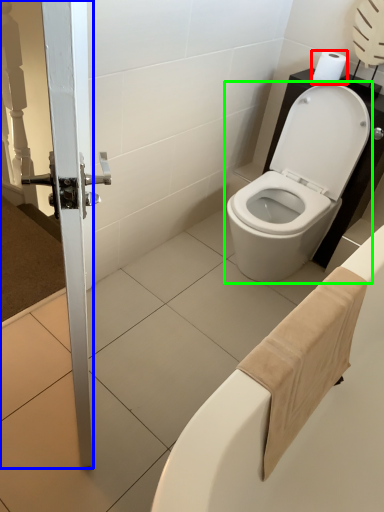
Question: Which is nearer to the toilet paper (highlighted by a red box)? screen door (highlighted by a blue box) or toilet (highlighted by a green box).

Choices:
 (A) screen door
 (B) toilet

Answer: (B)